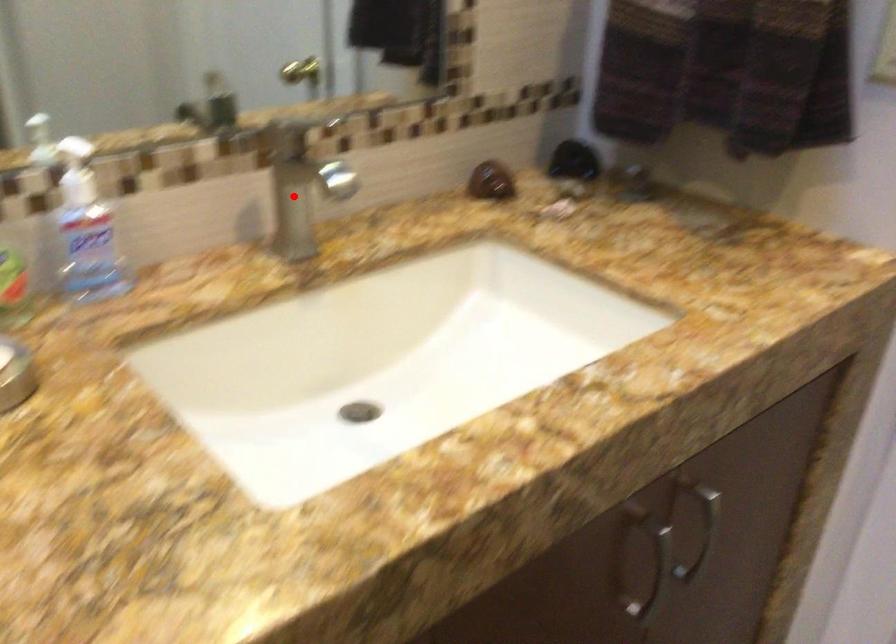
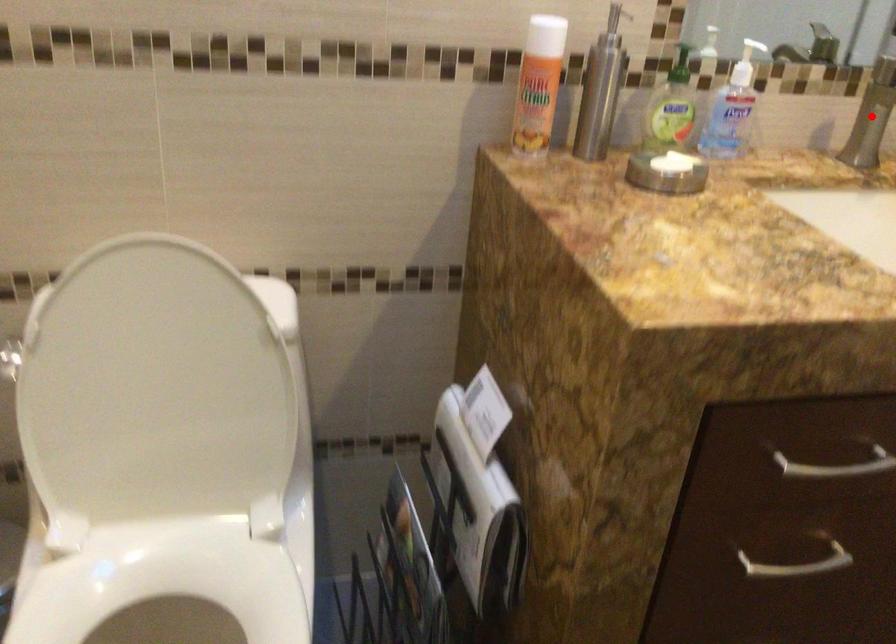
I am providing you with two images of the same scene from different viewpoints. A red point is marked on the first image and another point is marked on the second image. Are the points marked in image1 and image2 representing the same 3D position?

Yes